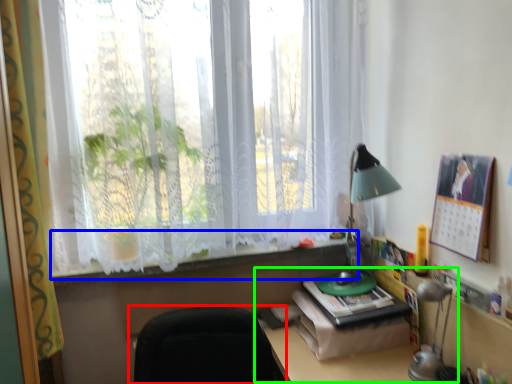
Question: Which is nearer to the chair (highlighted by a red box)? window sill (highlighted by a blue box) or computer desk (highlighted by a green box).

Choices:
 (A) window sill
 (B) computer desk

Answer: (B)